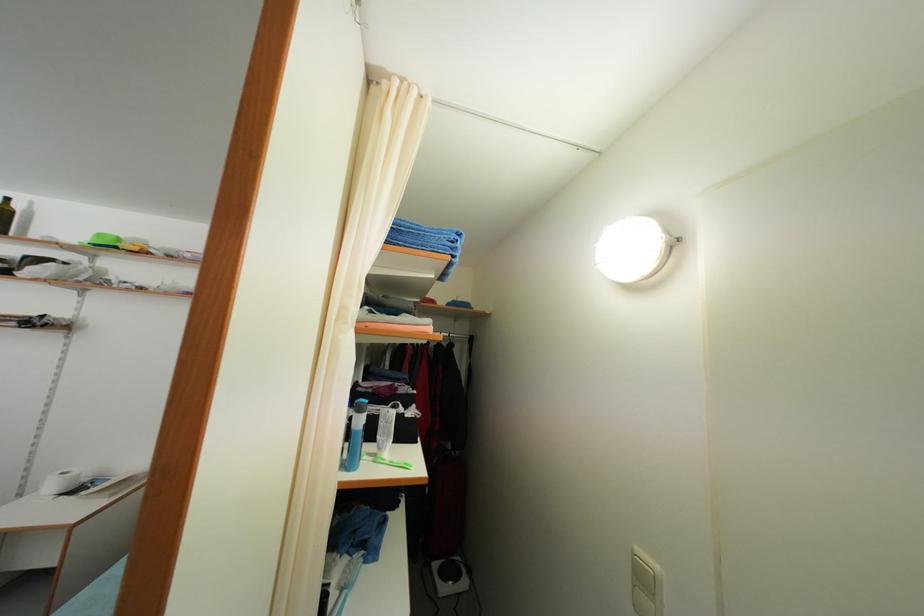
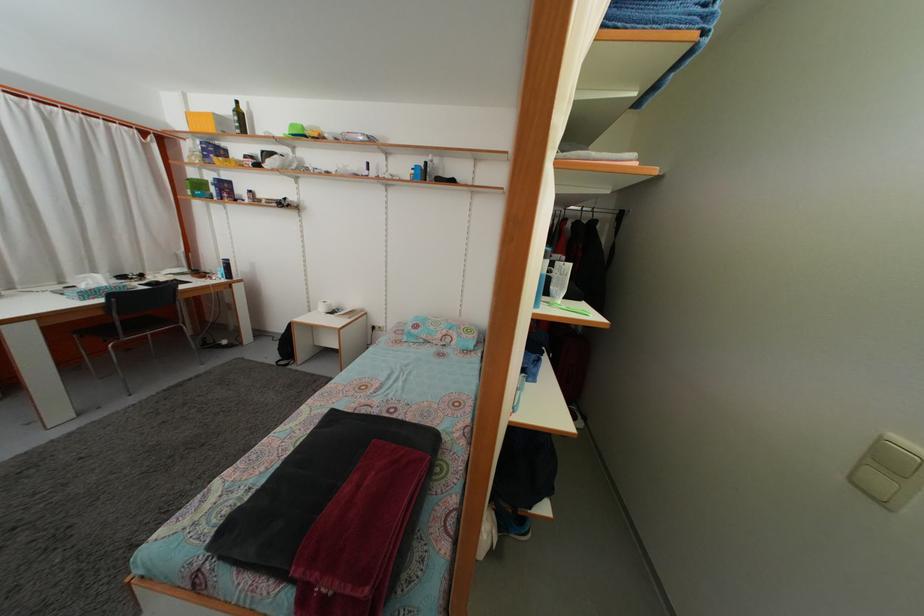
Where in the second image is the point corresponding to point 104,243 from the first image?

(298, 132)